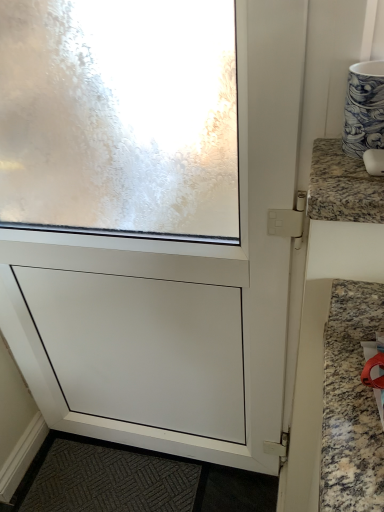
Question: Considering the positions of white matte screen door at center and granite mouse at upper right in the image, is white matte screen door at center bigger or smaller than granite mouse at upper right?

Choices:
 (A) big
 (B) small

Answer: (A)

Question: Is white matte screen door at center to the left or to the right of granite mouse at upper right in the image?

Choices:
 (A) right
 (B) left

Answer: (B)

Question: Is white matte screen door at center taller or shorter than granite mouse at upper right?

Choices:
 (A) tall
 (B) short

Answer: (A)

Question: Considering their positions, is granite mouse at upper right located in front of or behind white matte screen door at center?

Choices:
 (A) behind
 (B) front

Answer: (B)

Question: Is point (360, 190) positioned closer to the camera than point (231, 421)?

Choices:
 (A) closer
 (B) farther

Answer: (A)

Question: From a real-world perspective, is granite mouse at upper right above or below white matte screen door at center?

Choices:
 (A) above
 (B) below

Answer: (A)

Question: Is granite mouse at upper right taller or shorter than white matte screen door at center?

Choices:
 (A) tall
 (B) short

Answer: (B)